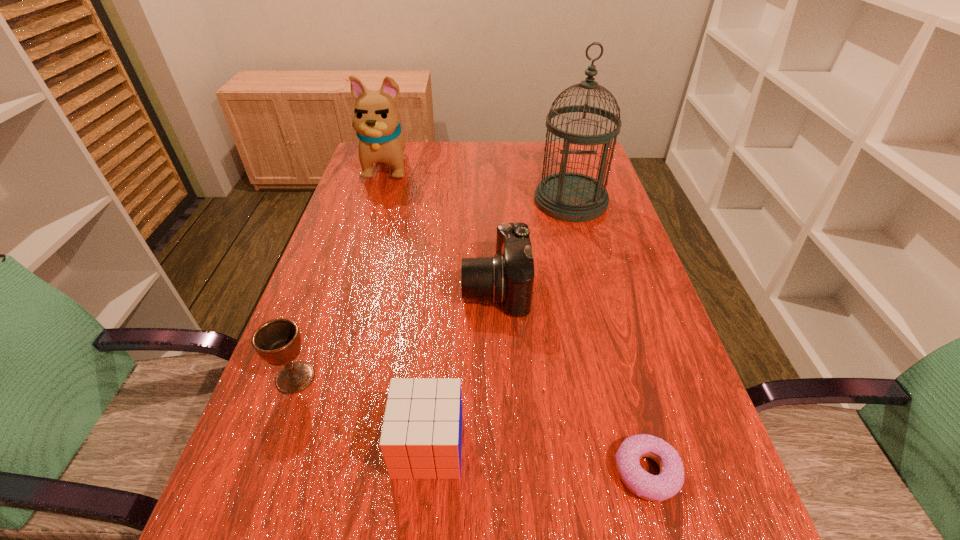
You are a GUI agent. You are given a task and a screenshot of the screen. Output one action in this format:
    pyautogui.click(x=<x>, y=<y>)
    Task: Click on the blank area located on the lens of the third farthest object
    This screenshot has width=960, height=540.
    Given the screenshot: What is the action you would take?
    pyautogui.click(x=350, y=287)

Locate an element on the screen. The height and width of the screenshot is (540, 960). free space located 0.350m on the right of the chalice is located at coordinates (499, 377).

Where is `free point located on the left of the cube`? The height and width of the screenshot is (540, 960). free point located on the left of the cube is located at coordinates (347, 446).

Where is `vacant point located 0.170m on the left of the shortest object`? This screenshot has width=960, height=540. vacant point located 0.170m on the left of the shortest object is located at coordinates (509, 472).

Where is `object positioned at the far edge`? object positioned at the far edge is located at coordinates tap(376, 118).

Locate an element on the screen. The width and height of the screenshot is (960, 540). puppy located in the left edge section of the desktop is located at coordinates (376, 118).

Image resolution: width=960 pixels, height=540 pixels. What are the coordinates of `chalice located in the left edge section of the desktop` in the screenshot? It's located at (278, 341).

Locate an element on the screen. birdcage that is at the right edge is located at coordinates (567, 196).

Where is `doughnut present at the right edge`? This screenshot has width=960, height=540. doughnut present at the right edge is located at coordinates (668, 483).

The width and height of the screenshot is (960, 540). In order to click on object that is at the far left corner in this screenshot , I will do `click(376, 118)`.